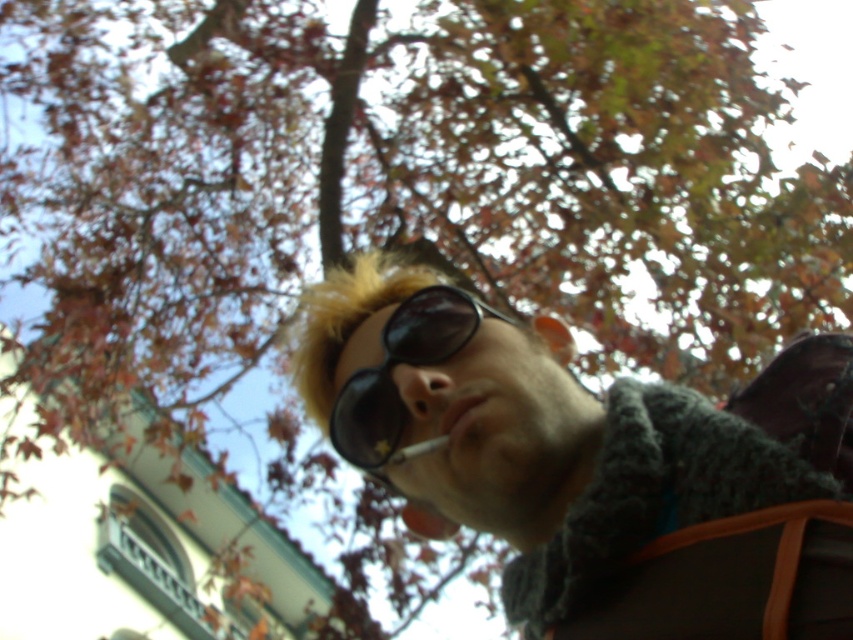
Question: Does matte black sunglasses at center appear over white matte cigarette at center?

Choices:
 (A) yes
 (B) no

Answer: (A)

Question: Among these points, which one is nearest to the camera?

Choices:
 (A) (393, 342)
 (B) (793, 490)
 (C) (436, 440)

Answer: (B)

Question: Does matte black sunglasses at center have a lesser width compared to black matte sunglasses at center?

Choices:
 (A) yes
 (B) no

Answer: (B)

Question: Which object is closer to the camera taking this photo?

Choices:
 (A) matte black sunglasses at center
 (B) black matte sunglasses at center
 (C) white matte cigarette at center

Answer: (A)

Question: Which point is closer to the camera?

Choices:
 (A) (416, 452)
 (B) (367, 378)

Answer: (A)

Question: Where is matte black sunglasses at center located in relation to white matte cigarette at center in the image?

Choices:
 (A) below
 (B) above

Answer: (B)